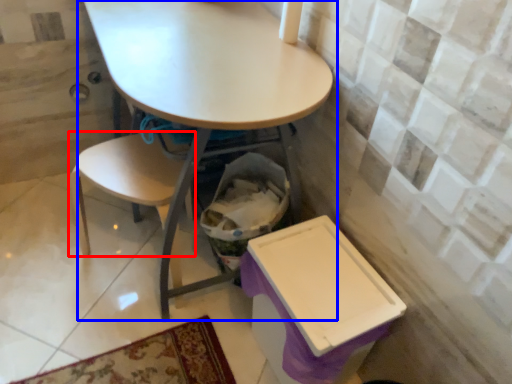
Question: Which of the following is the farthest to the observer, chair (highlighted by a red box) or table (highlighted by a blue box)?

Choices:
 (A) chair
 (B) table

Answer: (A)